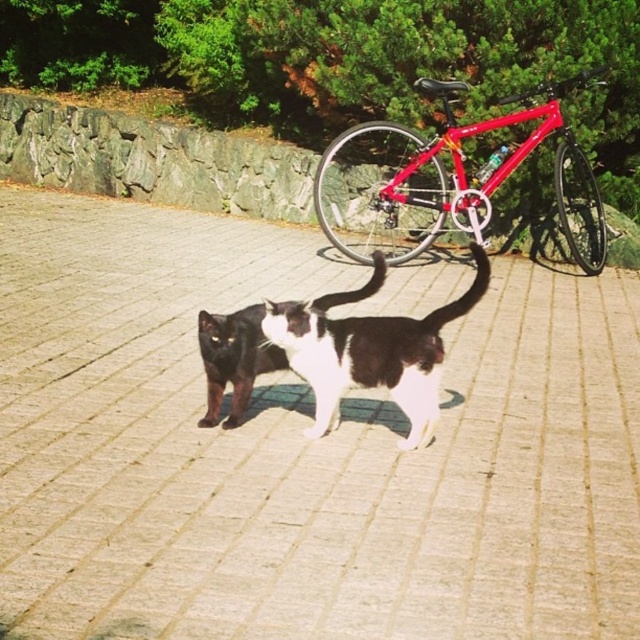
Question: Which of the following is the closest to the observer?

Choices:
 (A) (410, 342)
 (B) (570, 168)
 (C) (241, 419)
 (D) (636, 84)

Answer: (A)

Question: Considering the relative positions of brick pavement at center and black and white fur cat at center in the image provided, where is brick pavement at center located with respect to black and white fur cat at center?

Choices:
 (A) above
 (B) below

Answer: (B)

Question: Which of the following is the closest to the observer?

Choices:
 (A) (602, 6)
 (B) (259, 307)
 (C) (420, 564)

Answer: (C)

Question: Among these objects, which one is nearest to the camera?

Choices:
 (A) brick pavement at center
 (B) red glossy bicycle at center
 (C) black and white fur cat at center

Answer: (A)

Question: Is brick pavement at center closer to camera compared to black and white fur cat at center?

Choices:
 (A) yes
 (B) no

Answer: (A)

Question: Can you confirm if brick pavement at center is positioned above black and white fur cat at center?

Choices:
 (A) no
 (B) yes

Answer: (A)